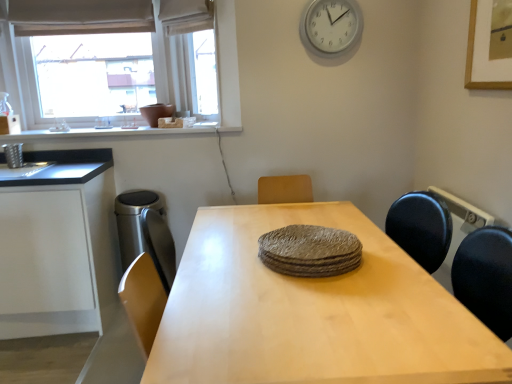
Question: From a real-world perspective, is light wood table at center positioned above or below satin silver trash can at left?

Choices:
 (A) above
 (B) below

Answer: (B)

Question: Is light wood table at center bigger or smaller than satin silver trash can at left?

Choices:
 (A) small
 (B) big

Answer: (B)

Question: Based on their relative distances, which object is farther from the light wood table at center?

Choices:
 (A) matte white window at upper left
 (B) white plastic clock at upper center
 (C) satin silver trash can at left
 (D) textured gray plates at center
 (E) white matte cabinet at left

Answer: (A)

Question: Based on their relative distances, which object is farther from the light wood table at center?

Choices:
 (A) textured gray plates at center
 (B) white matte cabinet at left
 (C) white matte window sill at upper left
 (D) white plastic clock at upper center
 (E) matte white window at upper left

Answer: (E)